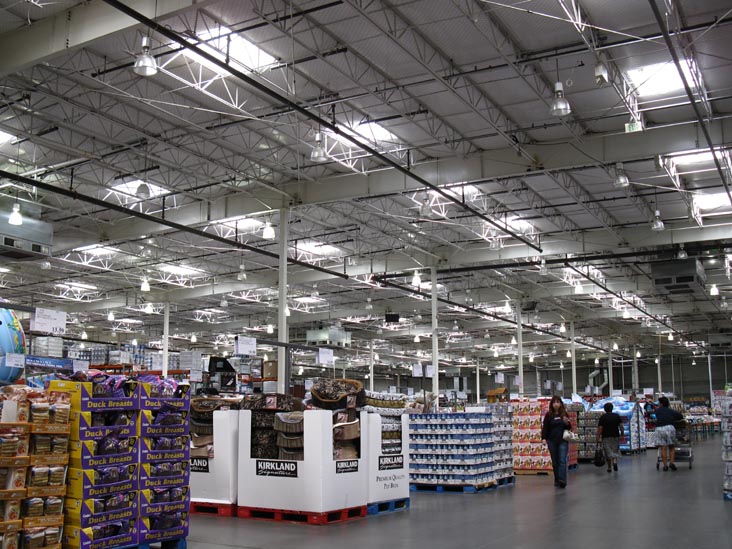
Locate an element on the screen. The height and width of the screenshot is (549, 732). floor is located at coordinates (539, 522).